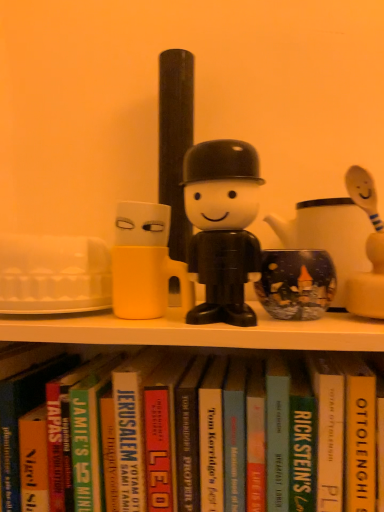
Question: Is there a large distance between hardcover book at center, which is counted as the 6th paperback book, starting from the right, and black plastic figure at center?

Choices:
 (A) no
 (B) yes

Answer: (A)

Question: Is hardcover book at center, the 1th paperback book positioned from the left, placed right next to black plastic figure at center?

Choices:
 (A) yes
 (B) no

Answer: (B)

Question: Does hardcover book at center, the 1th paperback book positioned from the left, have a larger size compared to black plastic figure at center?

Choices:
 (A) yes
 (B) no

Answer: (B)

Question: Considering the relative positions of hardcover book at center, the 1th paperback book positioned from the left, and black plastic figure at center in the image provided, is hardcover book at center, the 1th paperback book positioned from the left, to the left of black plastic figure at center from the viewer's perspective?

Choices:
 (A) yes
 (B) no

Answer: (A)

Question: Is hardcover book at center, which is counted as the 6th paperback book, starting from the right, looking in the opposite direction of black plastic figure at center?

Choices:
 (A) yes
 (B) no

Answer: (B)

Question: Is black plastic figure at center in front of or behind hardcover book at center, marked as the fourth paperback book in a left-to-right arrangement, in the image?

Choices:
 (A) behind
 (B) front

Answer: (B)

Question: Is black plastic figure at center spatially inside hardcover book at center, placed as the third paperback book when sorted from right to left, or outside of it?

Choices:
 (A) outside
 (B) inside

Answer: (A)

Question: Considering the positions of point (220, 145) and point (279, 451), is point (220, 145) closer or farther from the camera than point (279, 451)?

Choices:
 (A) closer
 (B) farther

Answer: (B)

Question: From a real-world perspective, is black plastic figure at center above or below hardcover book at center, placed as the third paperback book when sorted from right to left?

Choices:
 (A) above
 (B) below

Answer: (A)

Question: In terms of width, does hardcover book at center, the 1th paperback book positioned from the left, look wider or thinner when compared to black plastic figure at center?

Choices:
 (A) thin
 (B) wide

Answer: (B)

Question: Relative to black plastic figure at center, is hardcover book at center, the 1th paperback book positioned from the left, in front or behind?

Choices:
 (A) behind
 (B) front

Answer: (A)

Question: From their relative heights in the image, would you say hardcover book at center, the 1th paperback book positioned from the left, is taller or shorter than black plastic figure at center?

Choices:
 (A) tall
 (B) short

Answer: (B)

Question: Considering the positions of hardcover book at center, which is counted as the 6th paperback book, starting from the right, and black plastic figure at center in the image, is hardcover book at center, which is counted as the 6th paperback book, starting from the right, bigger or smaller than black plastic figure at center?

Choices:
 (A) small
 (B) big

Answer: (A)

Question: From the image's perspective, relative to yellow hardcover book at center, marked as the sixth paperback book in a left-to-right arrangement, is hardcover book at center, arranged as the second paperback book when viewed from the left, above or below?

Choices:
 (A) above
 (B) below

Answer: (B)

Question: Looking at the image, does hardcover book at center, the fifth paperback book when ordered from right to left, seem bigger or smaller compared to yellow hardcover book at center, arranged as the 1th paperback book when viewed from the right?

Choices:
 (A) big
 (B) small

Answer: (B)